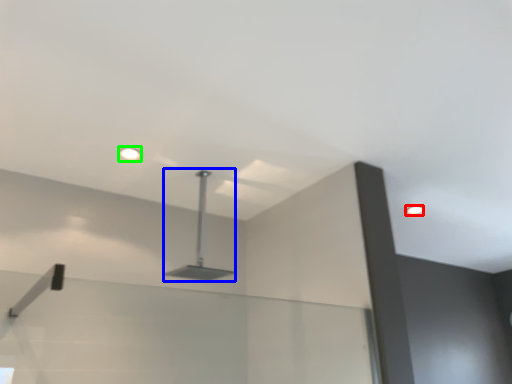
Question: Which object is positioned closest to droplight (highlighted by a red box)? Select from lamp (highlighted by a blue box) and droplight (highlighted by a green box).

Choices:
 (A) lamp
 (B) droplight

Answer: (A)